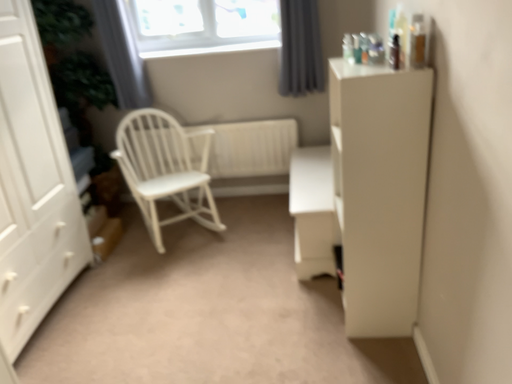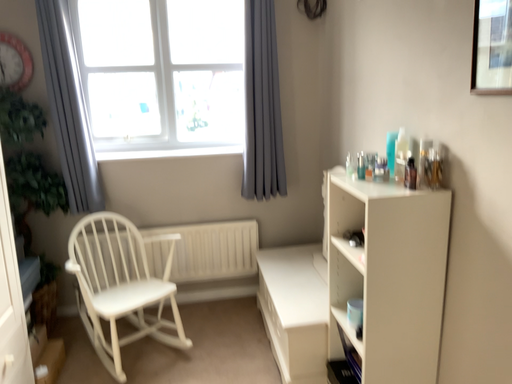
Question: Which way did the camera rotate in the video?

Choices:
 (A) rotated right
 (B) rotated left

Answer: (A)